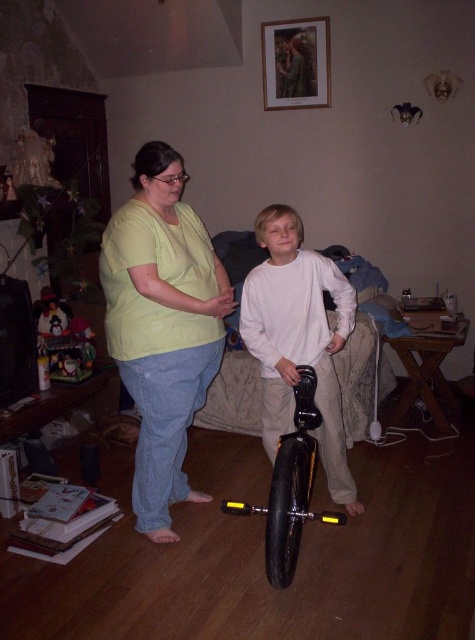
You are a visitor in the living room and see both the white matte unicycle at center and the black rubber monocycle at center. Which one is positioned more to the right side of the room?

The white matte unicycle at center is positioned more to the right side of the room than the black rubber monocycle at center.